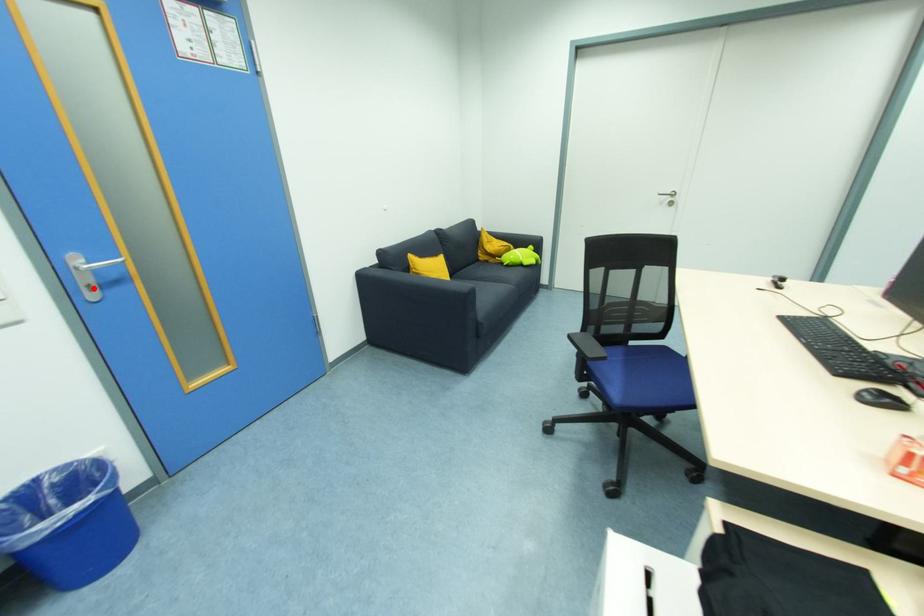
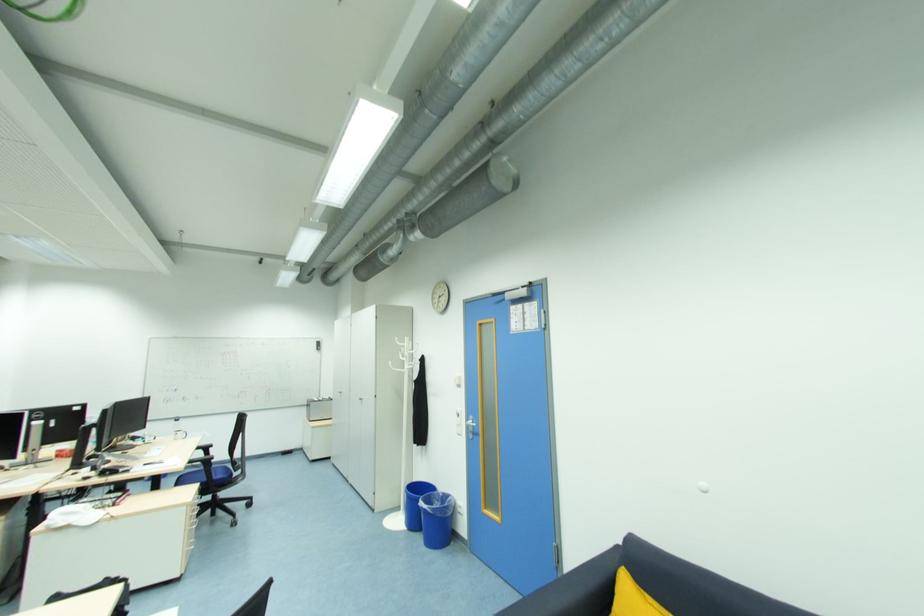
The point at the highlighted location is marked in the first image. Where is the corresponding point in the second image?

(473, 432)